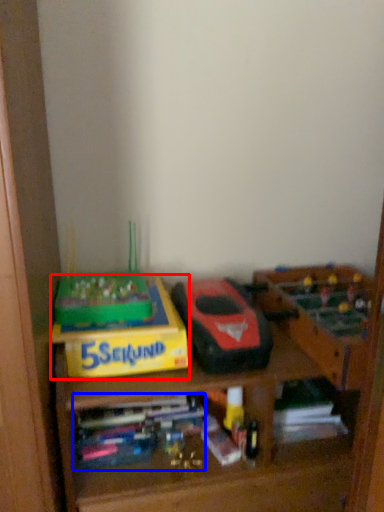
Question: Among these objects, which one is farthest to the camera, cardboard box (highlighted by a red box) or book (highlighted by a blue box)?

Choices:
 (A) cardboard box
 (B) book

Answer: (B)